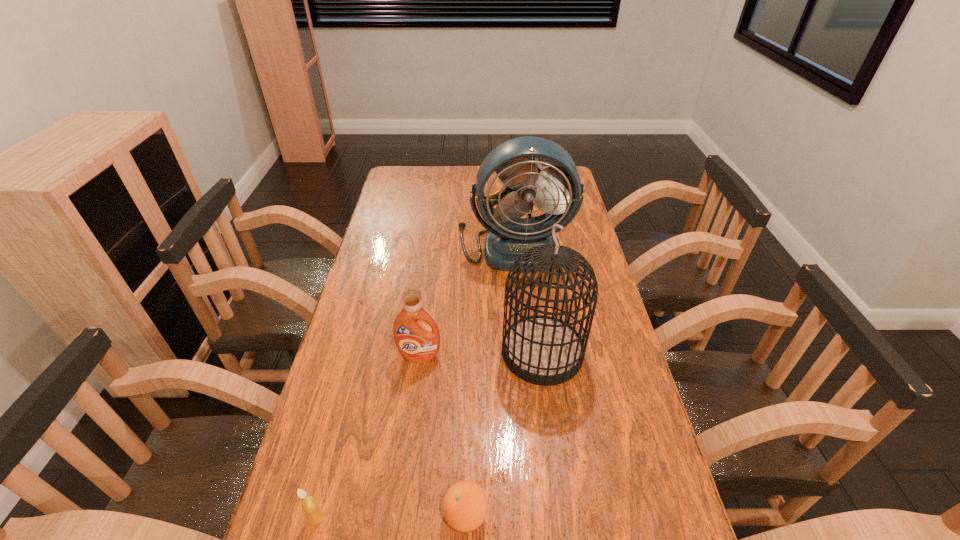
The width and height of the screenshot is (960, 540). I want to click on vacant space that satisfies the following two spatial constraints: 1. on the back side of the shortest object; 2. on the left side of the fourth tallest object, so click(x=318, y=515).